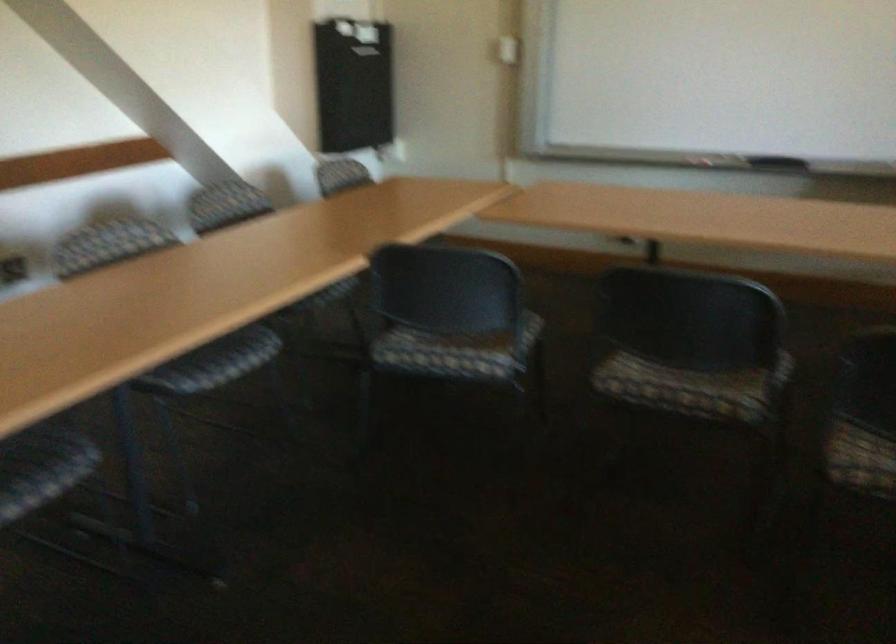
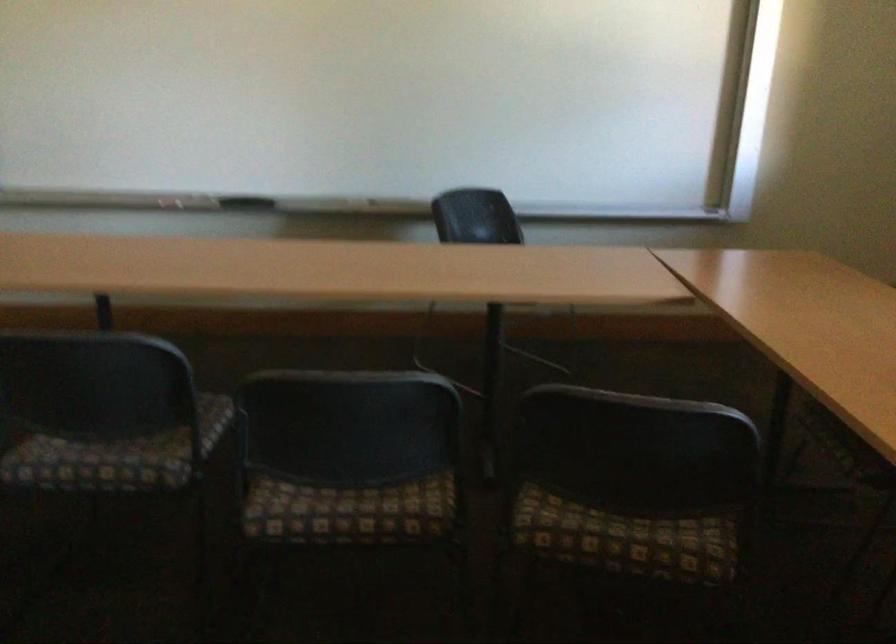
Question: The camera is either moving clockwise (left) or counter-clockwise (right) around the object. The first image is from the beginning of the video and the second image is from the end. Is the camera moving left or right when shooting the video?

Choices:
 (A) Left
 (B) Right

Answer: (A)